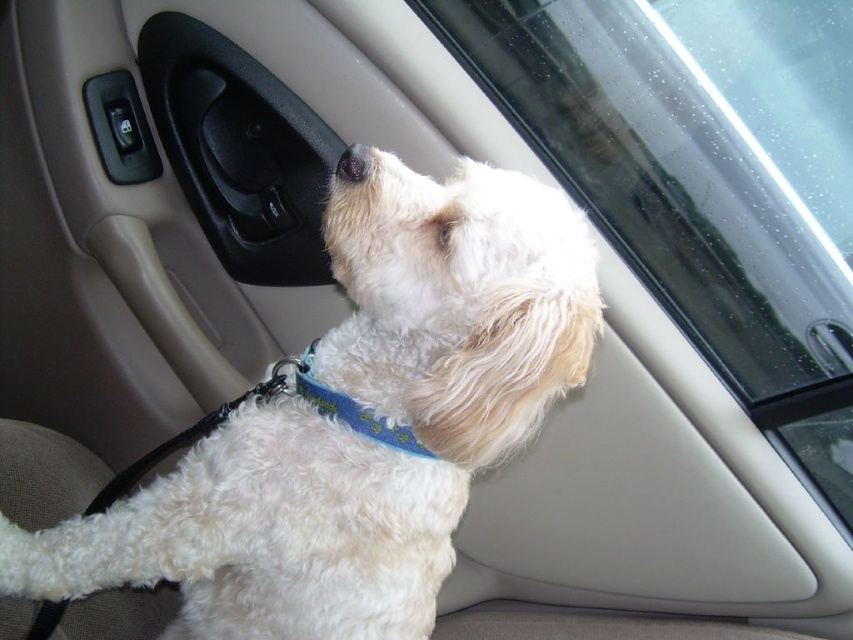
Question: Which object is closer to the camera taking this photo?

Choices:
 (A) black fur at upper center
 (B) blue fabric neckband at center
 (C) white fluffy dog at center

Answer: (C)

Question: Can you confirm if white fluffy dog at center is positioned below blue fabric neckband at center?

Choices:
 (A) no
 (B) yes

Answer: (B)

Question: Does white fluffy dog at center come in front of black fur at upper center?

Choices:
 (A) yes
 (B) no

Answer: (A)

Question: Which point is closer to the camera?

Choices:
 (A) (851, 506)
 (B) (390, 444)

Answer: (B)

Question: Which object is farther from the camera taking this photo?

Choices:
 (A) blue fabric neckband at center
 (B) white fluffy dog at center

Answer: (A)

Question: Does white fluffy dog at center appear on the right side of black fur at upper center?

Choices:
 (A) yes
 (B) no

Answer: (B)